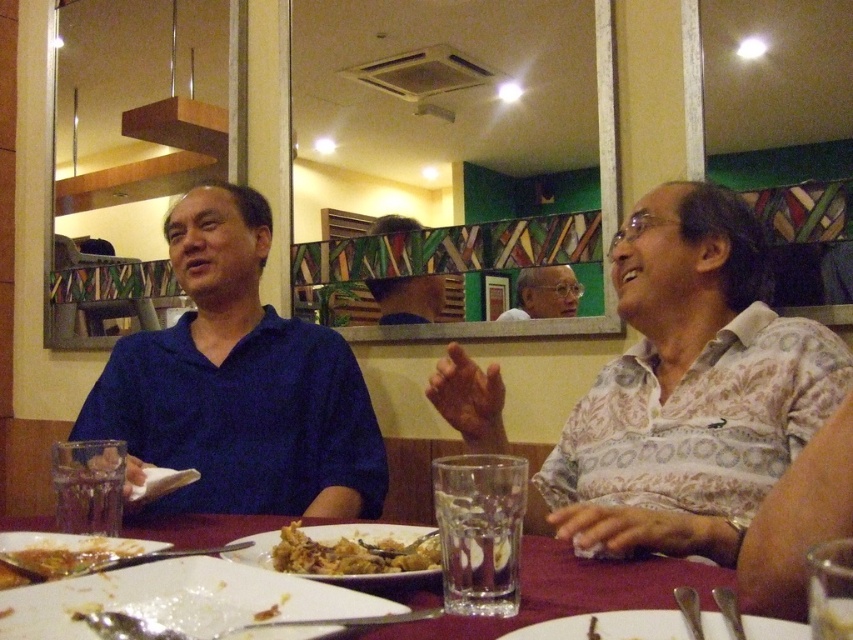
Based on the photo, you are a waiter trying to place a dessert menu between the marble table at center and the matte white shirt at center. Based on the scene, can you fit the menu between them?

The marble table at center is positioned on the left side of matte white shirt at center, so there is space between them to place the dessert menu.

You are a waiter in a restaurant and need to place a new drink order for the person wearing the matte white shirt at center. Where should you place the drink relative to the marble table at center?

The marble table at center is located below the matte white shirt at center, so the drink should be placed on the marble table at center near the matte white shirt at center.